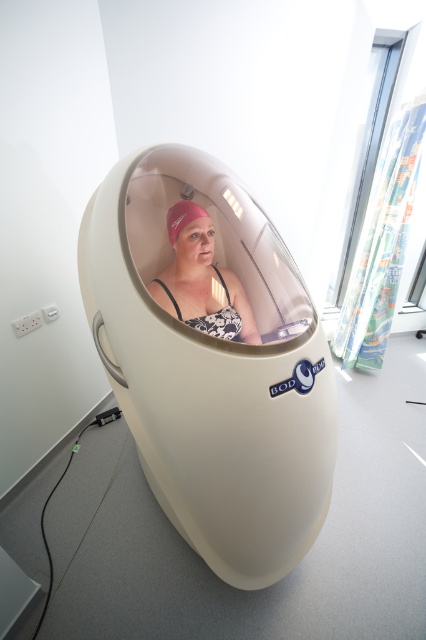
You are a GUI agent. You are given a task and a screenshot of the screen. Output one action in this format:
    pyautogui.click(x=<x>, y=<y>)
    Task: Click on the white matte capsule at center
    
    Given the screenshot: What is the action you would take?
    pyautogui.click(x=213, y=369)

Does point (149, 305) come in front of point (170, 228)?

Yes, point (149, 305) is in front of point (170, 228).

Is point (126, 202) more distant than point (253, 333)?

No, it is not.

You are a GUI agent. You are given a task and a screenshot of the screen. Output one action in this format:
    pyautogui.click(x=<x>, y=<y>)
    Task: Click on the white matte capsule at center
    
    Given the screenshot: What is the action you would take?
    pyautogui.click(x=213, y=369)